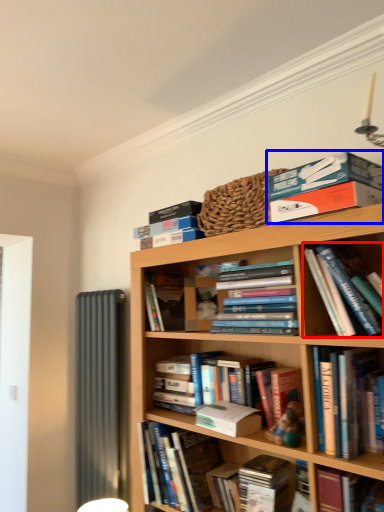
Question: Which object is closer to the camera taking this photo, book (highlighted by a red box) or book (highlighted by a blue box)?

Choices:
 (A) book
 (B) book

Answer: (A)